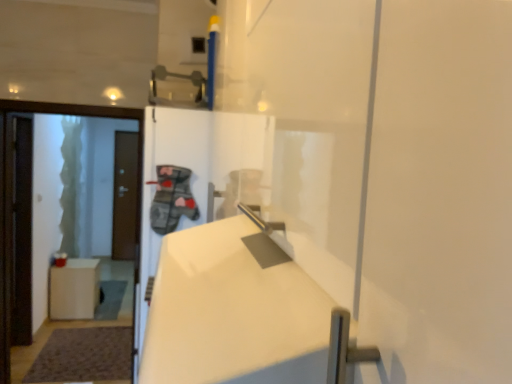
Image resolution: width=512 pixels, height=384 pixels. I want to click on free space above white glossy door at left, marked as the first door in a right-to-left arrangement (from a real-world perspective), so [69, 96].